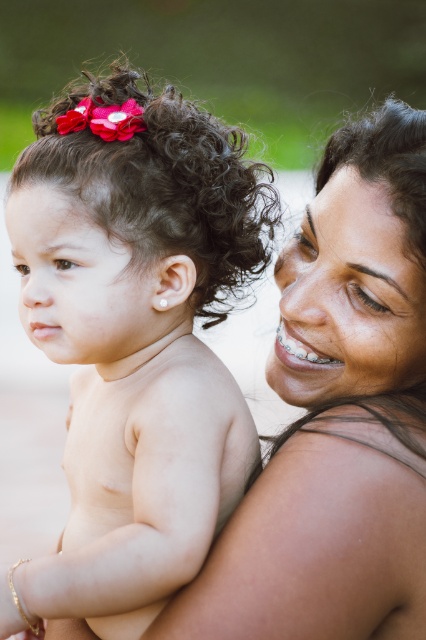
You are a photographer who wants to capture a closeup shot of both the smooth skin mother at upper right and the pale skin at upper right. Given that your camera can only focus on one subject at a time, which subject should you focus on first to ensure the other is still in the frame?

Answer: The smooth skin mother at upper right is wider than the pale skin at upper right, so focusing on the smooth skin mother at upper right first will ensure the pale skin at upper right remains in the frame.

You are a photographer trying to capture a closeup of the smooth skin mother at upper right without the pale skin at upper right appearing in the shot. Is this possible based on their positions?

The smooth skin mother at upper right is positioned over the pale skin at upper right, so it would be difficult to capture a closeup of the smooth skin mother at upper right without the pale skin at upper right appearing in the shot.